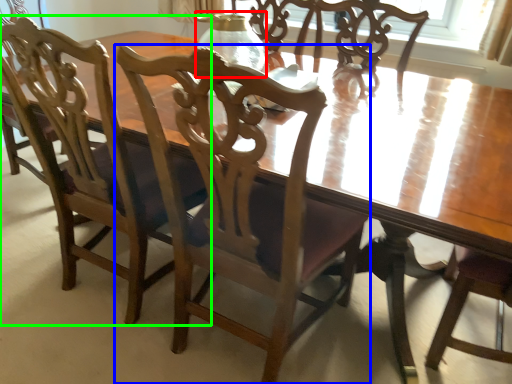
Question: Which is nearer to the glass vase (highlighted by a red box)? chair (highlighted by a blue box) or chair (highlighted by a green box).

Choices:
 (A) chair
 (B) chair

Answer: (A)